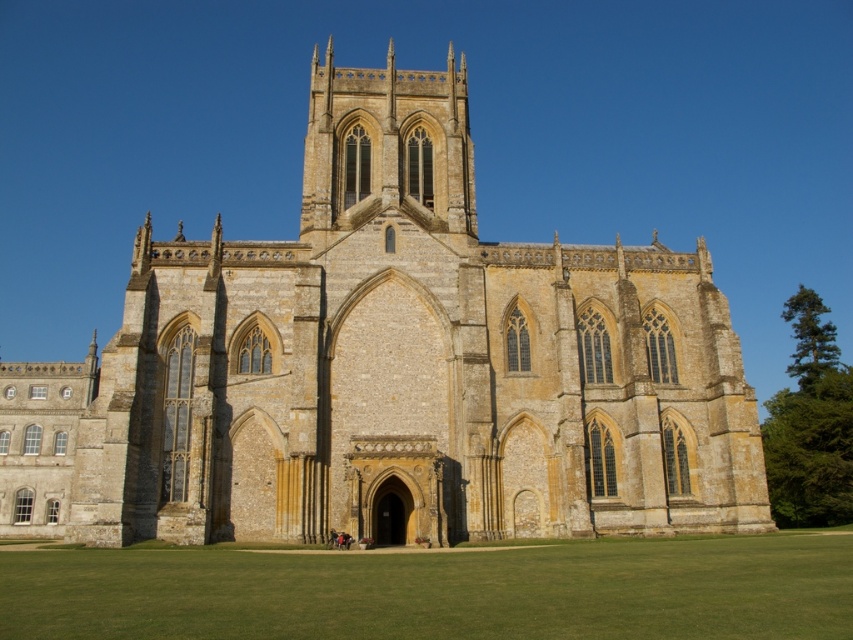
You are a GUI agent. You are given a task and a screenshot of the screen. Output one action in this format:
    pyautogui.click(x=<x>, y=<y>)
    Task: Click on the yellow stone church at center
    This screenshot has height=640, width=853.
    Given the screenshot: What is the action you would take?
    pyautogui.click(x=390, y=368)

Does point (323, 150) lie behind point (769, 552)?

That is True.

Identify the location of yellow stone church at center. (390, 368).